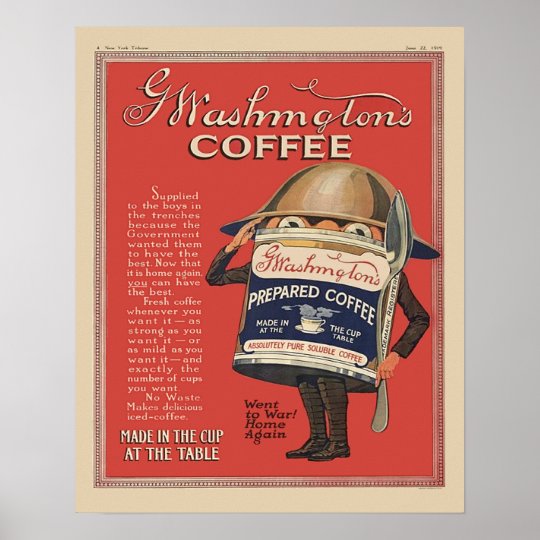
Locate an element on the screen. Image resolution: width=540 pixels, height=540 pixels. spoon is located at coordinates (379, 306).